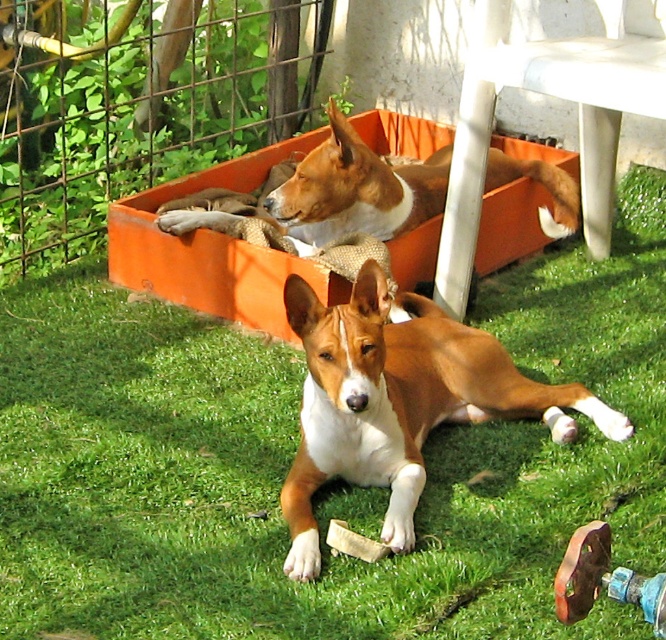
You are standing in the garden where the two dogs are resting. You want to place a small treat between the two points marked as point (601, 308) and point (619, 432). Which point should you place the treat closer to so that it is nearer to the dog lying on its side facing you?

You should place the treat closer to point (601, 308) because it is closer to the dog lying on its side facing you, as point (601, 308) is further to the viewer than point (619, 432).